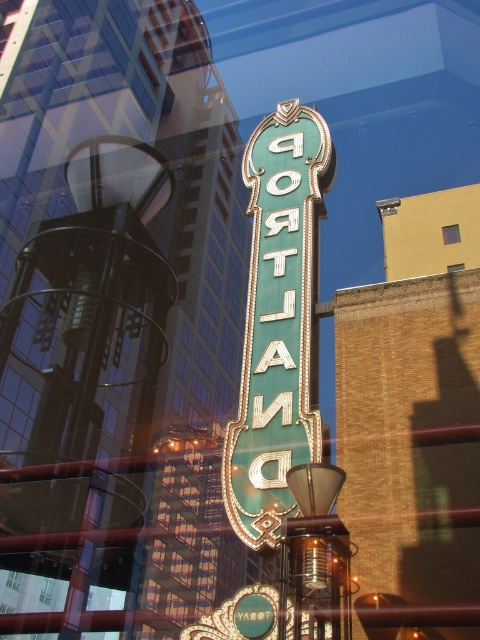
Which is behind, point (276, 330) or point (448, 241)?

Point (448, 241)

Who is more forward, [255,227] or [456,237]?

Positioned in front is point [255,227].

Find the location of a particular element. The height and width of the screenshot is (640, 480). green metallic sign at center is located at coordinates (277, 323).